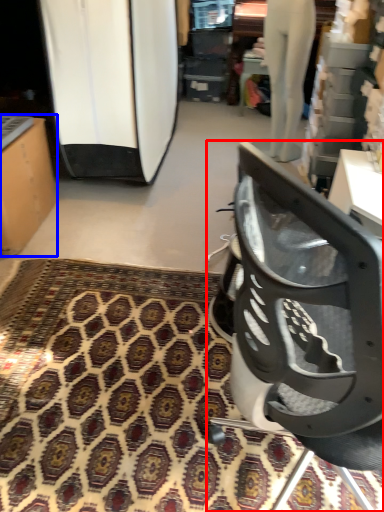
Question: Which object appears closest to the camera in this image, chair (highlighted by a red box) or furniture (highlighted by a blue box)?

Choices:
 (A) chair
 (B) furniture

Answer: (A)